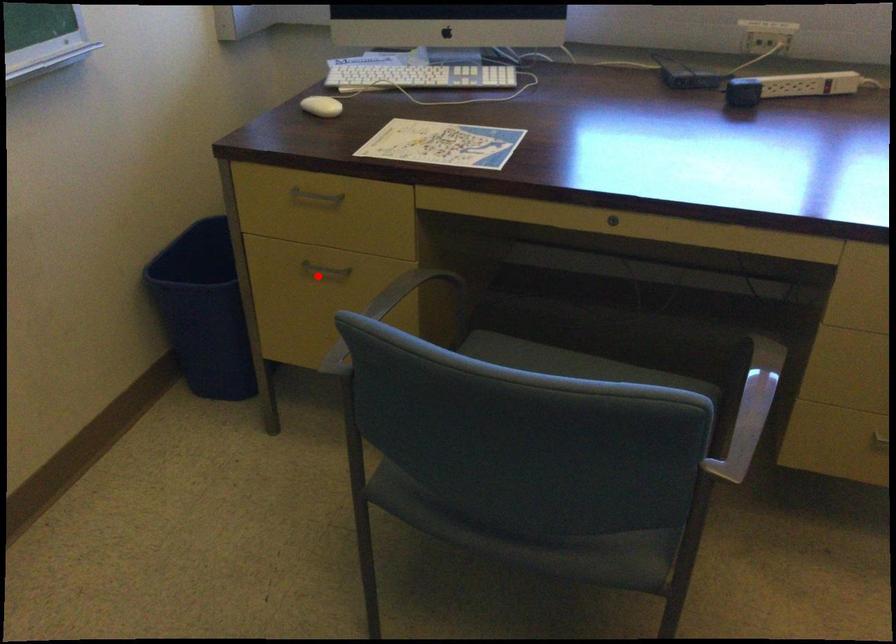
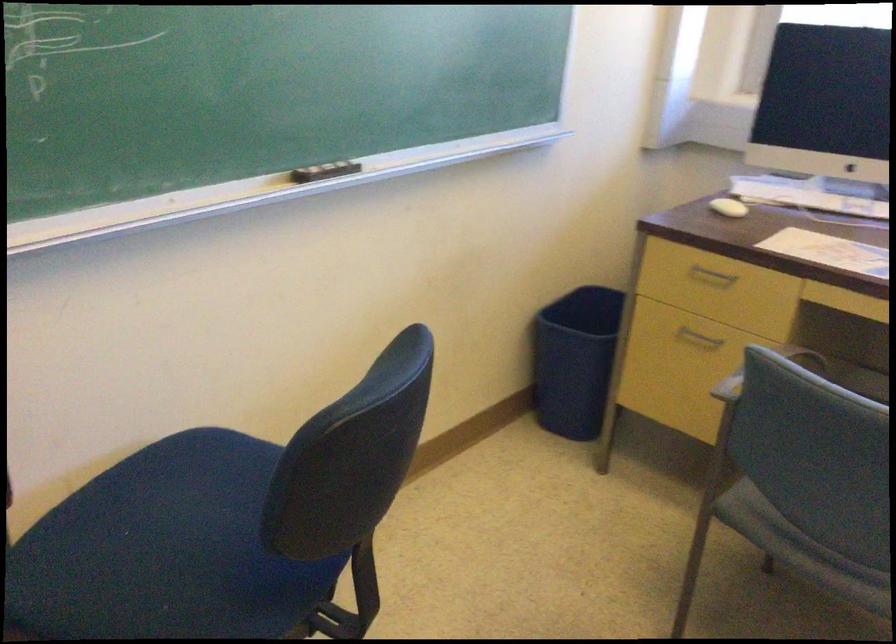
Locate, in the second image, the point that corresponds to the highlighted location in the first image.

(698, 337)